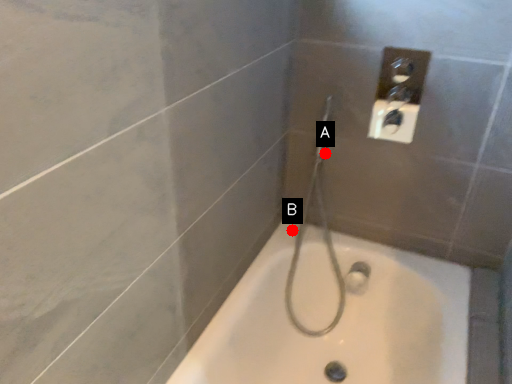
Question: Two points are circled on the image, labeled by A and B beside each circle. Which point is closer to the camera?

Choices:
 (A) A is closer
 (B) B is closer

Answer: (A)